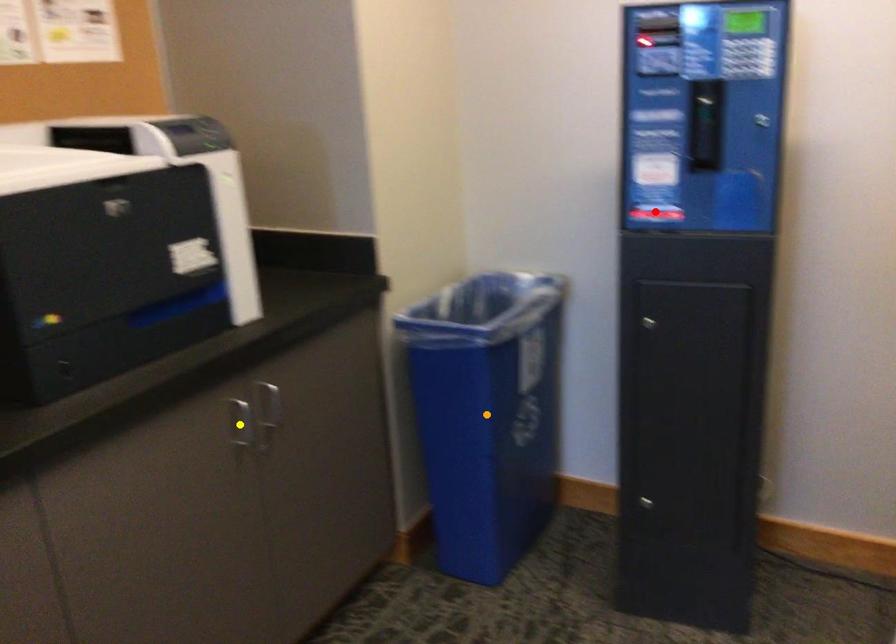
Order these from farthest to nearest:
red point, yellow point, orange point

orange point
red point
yellow point